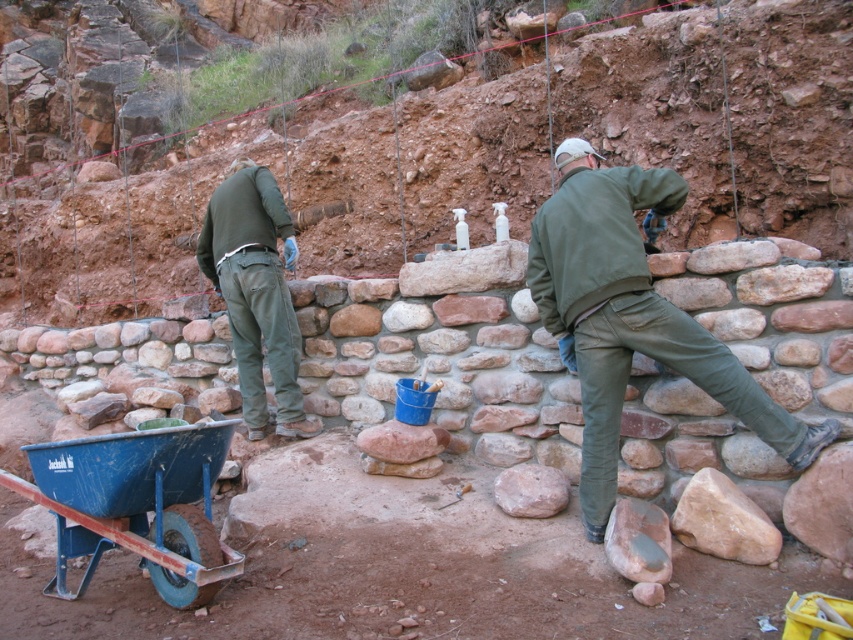
You are an archaeologist at the site and need to store a small tool. The green matte jacket at center and the blue plastic cart at lower left are nearby. Which object has enough space to store the tool?

The blue plastic cart at lower left has a greater width than the green matte jacket at center, so it likely has more space to store the tool.

You are an observer at the archaeological site and notice two workers in green attire. Which item of clothing, the green matte jacket at center or the green matte pants at center, covers a larger area of their body?

The green matte jacket at center is larger in size than the green matte pants at center, so it covers a larger area of their body.

You are a safety inspector at the archaeological site. You need to check if the green matte jacket at center is positioned in a safe area relative to the blue plastic cart at lower left. According to safety protocols, tools must be stored below all workers. Is the current arrangement compliant?

The green matte jacket at center is above the blue plastic cart at lower left, so the arrangement is compliant with safety protocols since the cart is positioned below the worker.